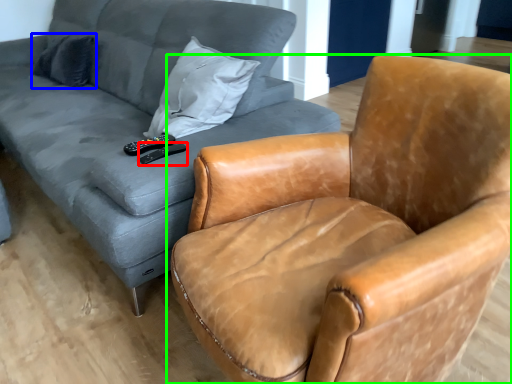
Question: Estimate the real-world distances between objects in this image. Which object is closer to remote (highlighted by a red box), pillow (highlighted by a blue box) or chair (highlighted by a green box)?

Choices:
 (A) pillow
 (B) chair

Answer: (B)